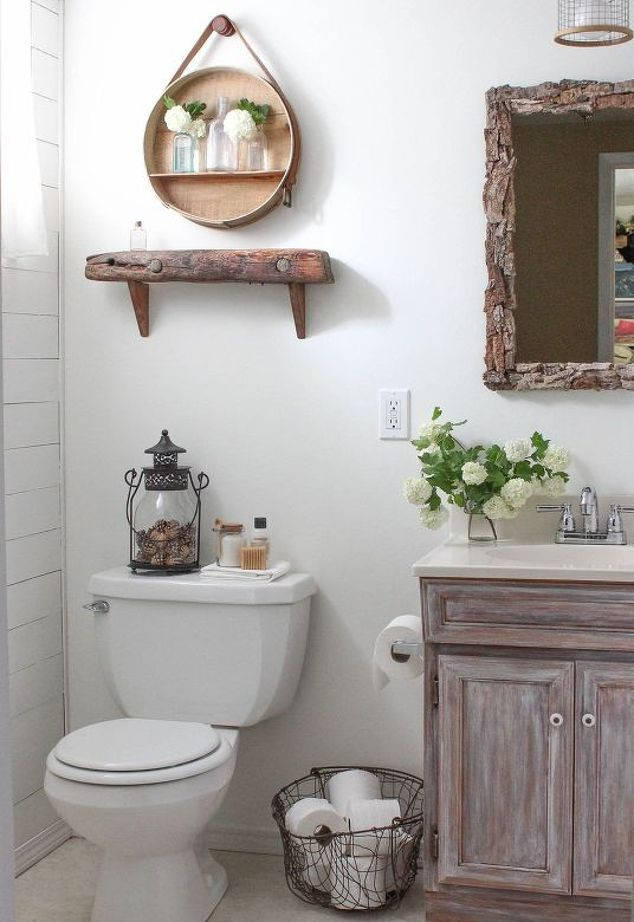
Where is `top of sink`? top of sink is located at coordinates (473, 557).